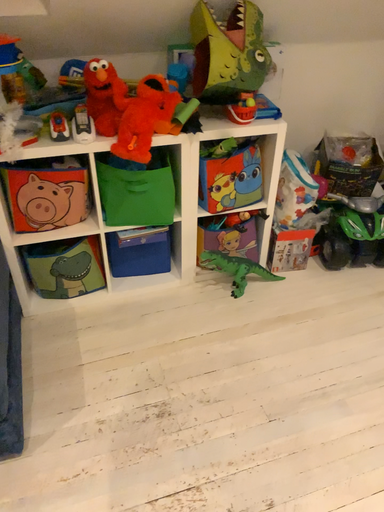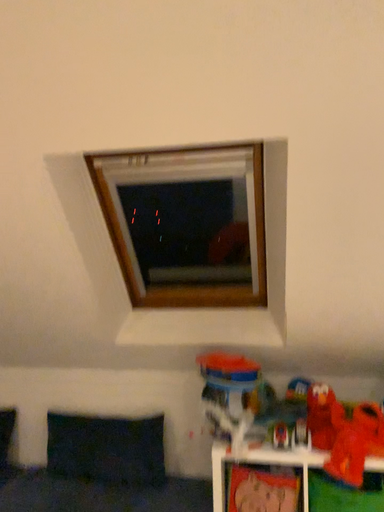
Question: How did the camera likely rotate when shooting the video?

Choices:
 (A) rotated upward
 (B) rotated downward

Answer: (A)